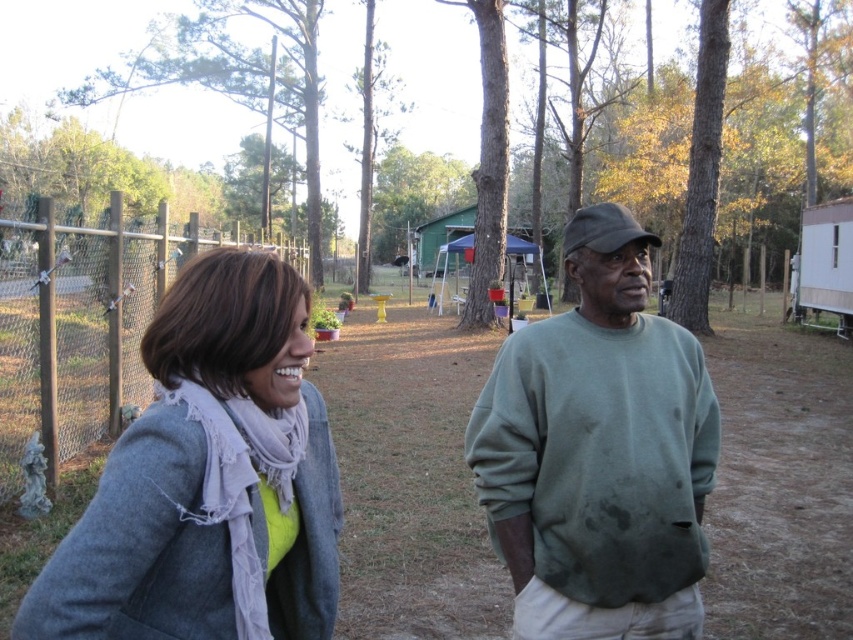
You are a fashion designer observing the two outfits in the image. The gray woolen coat at left and the green matte sweatshirt at center. Which one is smaller in size?

The gray woolen coat at left has a smaller size compared to the green matte sweatshirt at center, so the gray woolen coat at left is smaller in size.

Please describe the position of the gray sweater at center in the image using coordinates. The answer should be in the format of coordinates like this example format of 0.5,0.5

The gray sweater at center is located at coordinates (x=599, y=451).

You are a clothing designer analyzing the image. You need to determine if the gray sweater at center can be worn over the gray woolen coat at left without looking too bulky. Based on their sizes, what would you advise?

The gray sweater at center might be wider than gray woolen coat at left, so wearing the gray sweater at center over the gray woolen coat at left could result in a bulky appearance due to its potentially larger width.